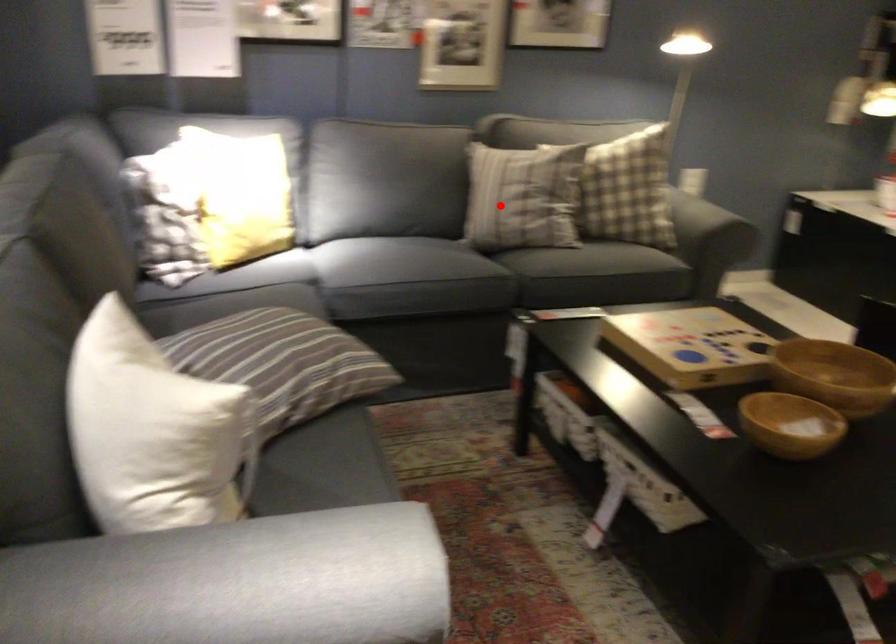
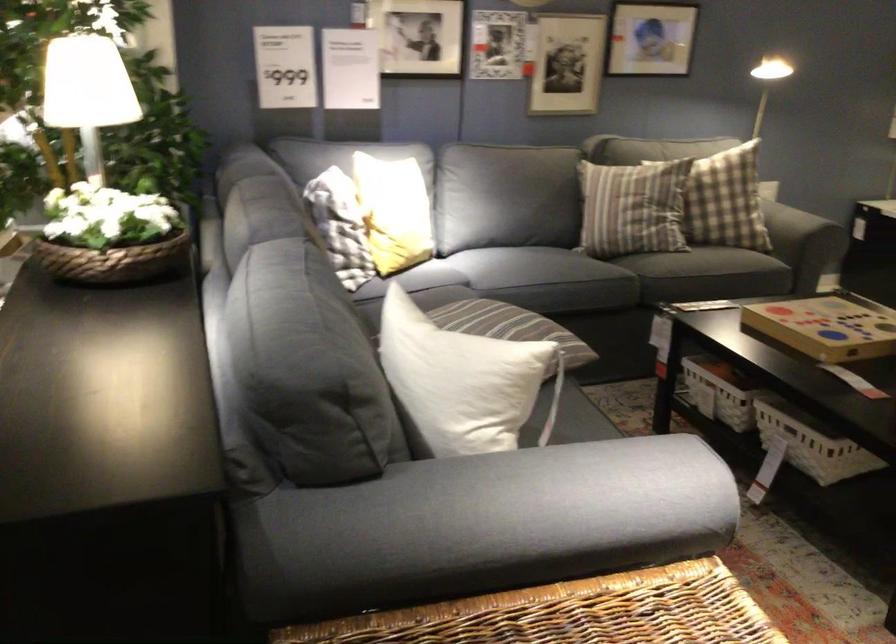
The point at the highlighted location is marked in the first image. Where is the corresponding point in the second image?

(633, 207)